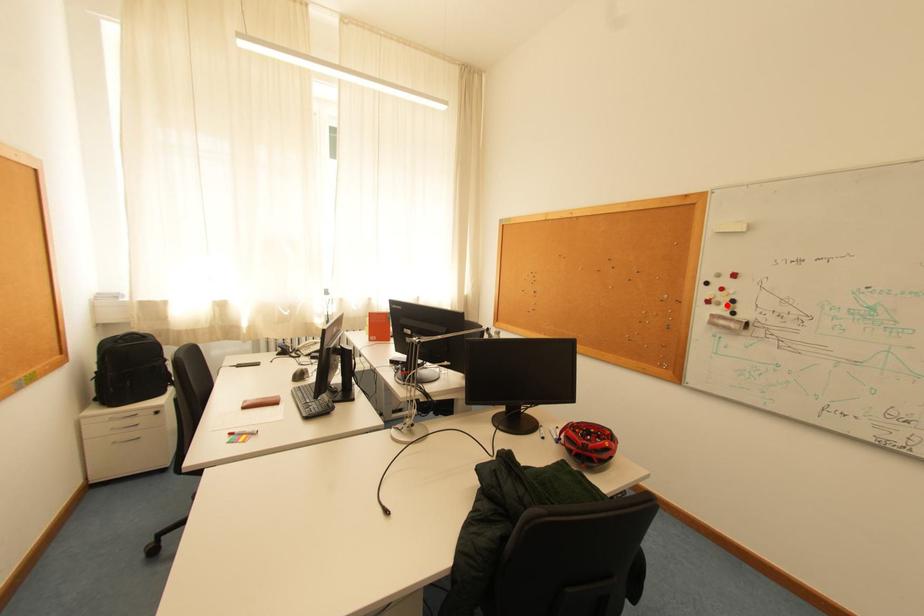
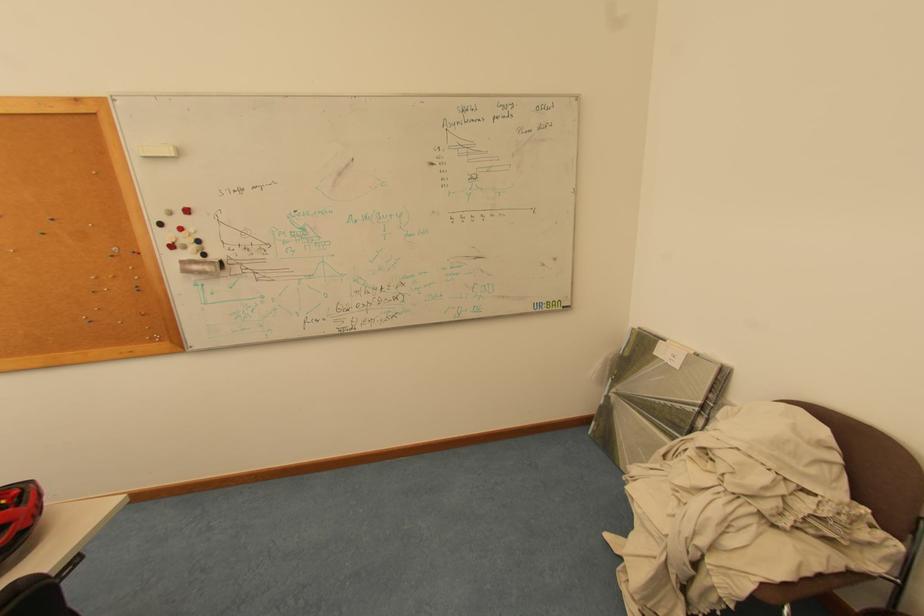
Find the pixel in the second image that matches the highlighted location in the first image.

(193, 249)